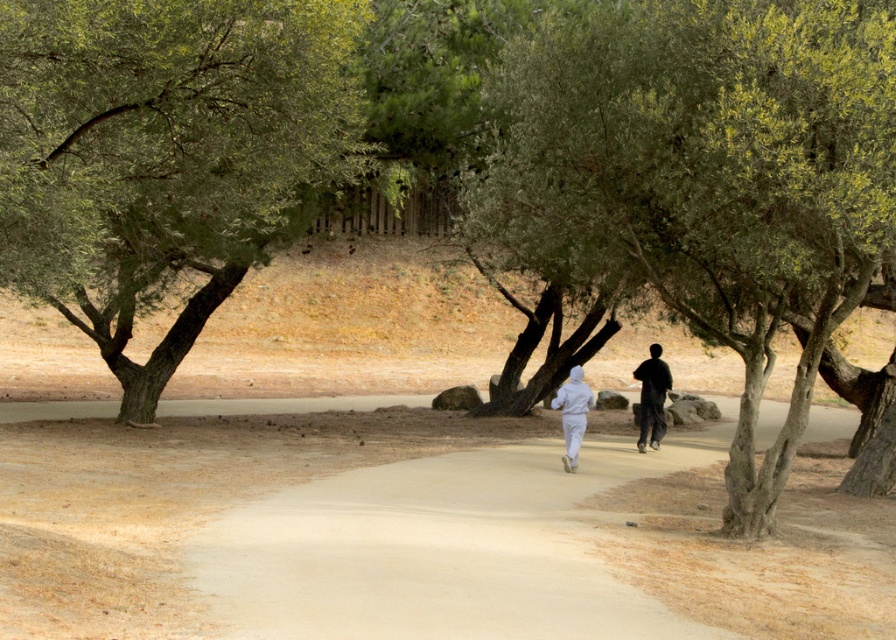
You are a photographer positioned at the starting point of the path. You want to capture both the white matte hoodie at center and the white matte running suit at center in a single shot. Which person should you focus on first to ensure both are in frame?

You should focus on the white matte hoodie at center first because it is closer to the viewer than the white matte running suit at center, ensuring both are within the frame.

You are standing at the starting point of the path and want to take a photo of the two people walking away. Which object, the green leafy tree at left or the white matte running suit at center, will appear larger in the photo?

The green leafy tree at left will appear larger in the photo because it is taller than the white matte running suit at center.

You are a photographer trying to capture a photo of the two people walking along the path. You want to ensure the green leafy tree at left and the white matte running suit at center are both in the frame. Considering their sizes, which object should you focus on first to ensure both are clearly visible?

The green leafy tree at left has a larger size compared to the white matte running suit at center, so you should focus on the green leafy tree at left first to ensure both are clearly visible.